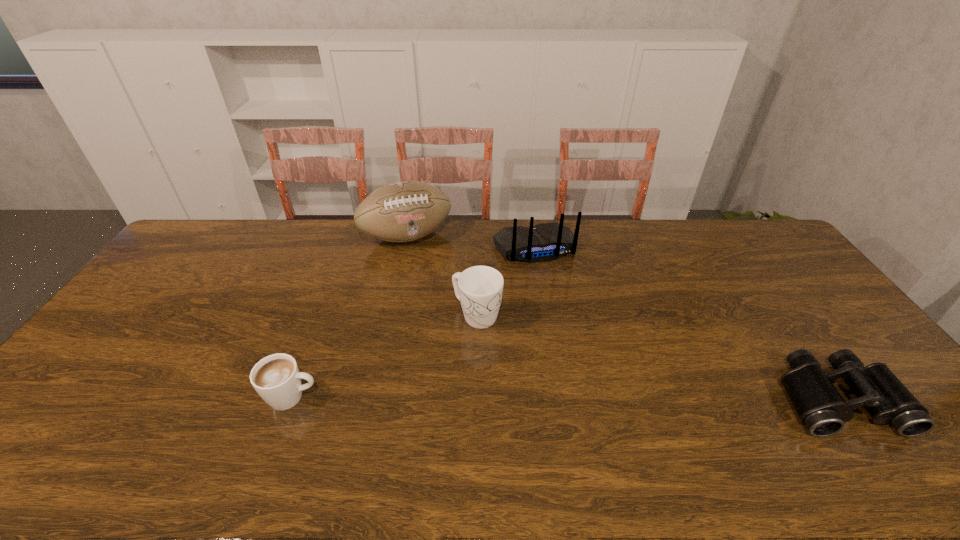
Locate an element on the screen. blank space located on the side of the mug with the handle is located at coordinates (579, 382).

Image resolution: width=960 pixels, height=540 pixels. Identify the location of vacant region located 0.160m on the side of the mug with the handle. (540, 356).

Identify the location of free spot located on the side of the mug with the handle. (616, 407).

The image size is (960, 540). Identify the location of blank space located 0.160m on the laces of the football (American). (437, 281).

Identify the location of free region located 0.120m on the laces of the football (American). (433, 274).

Where is `free region located on the laces of the football (American)`? This screenshot has height=540, width=960. free region located on the laces of the football (American) is located at coordinates (448, 302).

At what (x,y) coordinates should I click in order to perform the action: click on router that is at the far edge. Please return your answer as a coordinate pair (x, y). This screenshot has height=540, width=960. Looking at the image, I should click on (543, 242).

The width and height of the screenshot is (960, 540). Find the location of `football (American) located in the far edge section of the desktop`. football (American) located in the far edge section of the desktop is located at coordinates (404, 211).

Where is `cappuccino situated at the near edge`? The height and width of the screenshot is (540, 960). cappuccino situated at the near edge is located at coordinates (276, 378).

I want to click on binoculars present at the near edge, so click(820, 407).